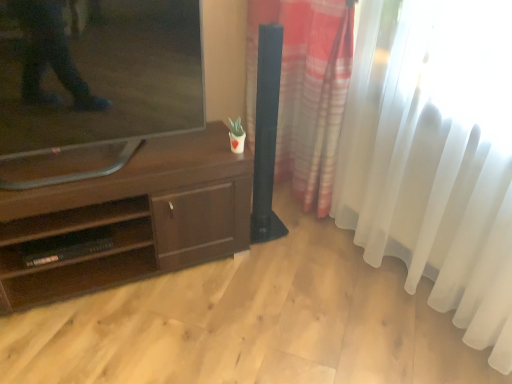
What is the approximate width of translucent fabric curtain at right?

11.71 inches.

In the scene shown: What is the approximate height of translucent fabric curtain at right?

1.30 meters.

The height and width of the screenshot is (384, 512). I want to click on black plastic shelf at lower left, so click(x=73, y=246).

From a real-world perspective, between dark brown wood tv stand at center and matte black tv at left, who is vertically higher?

From a 3D spatial view, matte black tv at left is above.

From the picture: Would you say dark brown wood tv stand at center is a long distance from matte black tv at left?

No, dark brown wood tv stand at center is in close proximity to matte black tv at left.

Could you tell me if dark brown wood tv stand at center is turned towards matte black tv at left?

No, dark brown wood tv stand at center is not oriented towards matte black tv at left.

What's the angular difference between dark brown wood tv stand at center and matte black tv at left's facing directions?

0.974 degrees.

Find the location of `curtain in front of the black plastic shelf at lower left`. curtain in front of the black plastic shelf at lower left is located at coordinates (435, 156).

Can you tell me how much translucent fabric curtain at right and black plastic shelf at lower left differ in facing direction?

79.3 degrees.

From a real-world perspective, which is physically above, translucent fabric curtain at right or black plastic shelf at lower left?

From a 3D spatial view, translucent fabric curtain at right is above.

Is the position of translucent fabric curtain at right less distant than that of black plastic shelf at lower left?

Yes, it is.

Does dark brown wood tv stand at center have a greater height compared to black plastic shelf at lower left?

Yes.

From the image's perspective, who appears lower, dark brown wood tv stand at center or black plastic shelf at lower left?

black plastic shelf at lower left.

Based on the photo, which is more to the left, dark brown wood tv stand at center or black plastic shelf at lower left?

black plastic shelf at lower left is more to the left.

Considering the sizes of objects dark brown wood tv stand at center and black plastic shelf at lower left in the image provided, who is bigger, dark brown wood tv stand at center or black plastic shelf at lower left?

dark brown wood tv stand at center is bigger.

Can you confirm if matte black tv at left is thinner than dark brown wood tv stand at center?

Yes, matte black tv at left is thinner than dark brown wood tv stand at center.

Would you say matte black tv at left is to the left or to the right of dark brown wood tv stand at center in the picture?

From the image, it's evident that matte black tv at left is to the right of dark brown wood tv stand at center.

From their relative heights in the image, would you say matte black tv at left is taller or shorter than dark brown wood tv stand at center?

Clearly, matte black tv at left is taller compared to dark brown wood tv stand at center.

Is dark brown wood tv stand at center situated inside translucent fabric curtain at right or outside?

dark brown wood tv stand at center lies outside translucent fabric curtain at right.

From the image's perspective, is dark brown wood tv stand at center under translucent fabric curtain at right?

Yes.

You are a GUI agent. You are given a task and a screenshot of the screen. Output one action in this format:
    pyautogui.click(x=<x>, y=<y>)
    Task: Click on the curtain above the dark brown wood tv stand at center (from a real-world perspective)
    
    Given the screenshot: What is the action you would take?
    pyautogui.click(x=435, y=156)

Which is more to the right, matte black tv at left or black plastic shelf at lower left?

Positioned to the right is matte black tv at left.

Is matte black tv at left thinner than black plastic shelf at lower left?

No, matte black tv at left is not thinner than black plastic shelf at lower left.

Considering the sizes of objects matte black tv at left and black plastic shelf at lower left in the image provided, who is bigger, matte black tv at left or black plastic shelf at lower left?

matte black tv at left.

Image resolution: width=512 pixels, height=384 pixels. What are the coordinates of `television that is on the right side of black plastic shelf at lower left` in the screenshot? It's located at (94, 84).

Considering the relative sizes of black plastic shelf at lower left and dark brown wood tv stand at center in the image provided, is black plastic shelf at lower left taller than dark brown wood tv stand at center?

Incorrect, the height of black plastic shelf at lower left is not larger of that of dark brown wood tv stand at center.

Is black plastic shelf at lower left looking in the opposite direction of dark brown wood tv stand at center?

Absolutely, black plastic shelf at lower left is directed away from dark brown wood tv stand at center.

Is black plastic shelf at lower left inside or outside of dark brown wood tv stand at center?

black plastic shelf at lower left is located inside dark brown wood tv stand at center.

You are a GUI agent. You are given a task and a screenshot of the screen. Output one action in this format:
    pyautogui.click(x=<x>, y=<y>)
    Task: Click on the television that appears on the right of dark brown wood tv stand at center
    Image resolution: width=512 pixels, height=384 pixels.
    Given the screenshot: What is the action you would take?
    pyautogui.click(x=94, y=84)

Where is `curtain above the black plastic shelf at lower left (from the image's perspective)`? The width and height of the screenshot is (512, 384). curtain above the black plastic shelf at lower left (from the image's perspective) is located at coordinates (435, 156).

Based on their spatial positions, is translucent fabric curtain at right or dark brown wood tv stand at center further from matte black tv at left?

translucent fabric curtain at right is further to matte black tv at left.

Which object lies further to the anchor point translucent fabric curtain at right, dark brown wood tv stand at center or black plastic shelf at lower left?

Among the two, black plastic shelf at lower left is located further to translucent fabric curtain at right.

From the image, which object appears to be nearer to translucent fabric curtain at right, black plastic shelf at lower left or dark brown wood tv stand at center?

Among the two, dark brown wood tv stand at center is located nearer to translucent fabric curtain at right.

Considering their positions, is black plastic shelf at lower left positioned further to matte black tv at left than dark brown wood tv stand at center?

The object further to matte black tv at left is black plastic shelf at lower left.

From the picture: Considering their positions, is dark brown wood tv stand at center positioned closer to translucent fabric curtain at right than matte black tv at left?

dark brown wood tv stand at center is closer to translucent fabric curtain at right.

When comparing their distances from black plastic shelf at lower left, does dark brown wood tv stand at center or matte black tv at left seem further?

Among the two, matte black tv at left is located further to black plastic shelf at lower left.

From the image, which object appears to be nearer to black plastic shelf at lower left, translucent fabric curtain at right or dark brown wood tv stand at center?

dark brown wood tv stand at center lies closer to black plastic shelf at lower left than the other object.

When comparing their distances from matte black tv at left, does black plastic shelf at lower left or translucent fabric curtain at right seem further?

translucent fabric curtain at right.

Identify the location of desk between matte black tv at left and black plastic shelf at lower left in the up-down direction. (131, 219).

At what (x,y) coordinates should I click in order to perform the action: click on television between dark brown wood tv stand at center and translucent fabric curtain at right in the horizontal direction. Please return your answer as a coordinate pair (x, y). This screenshot has width=512, height=384. Looking at the image, I should click on (94, 84).

Locate an element on the screen. Image resolution: width=512 pixels, height=384 pixels. television between black plastic shelf at lower left and translucent fabric curtain at right is located at coordinates (94, 84).

Where is `desk located between black plastic shelf at lower left and translucent fabric curtain at right in the left-right direction`? The image size is (512, 384). desk located between black plastic shelf at lower left and translucent fabric curtain at right in the left-right direction is located at coordinates (131, 219).